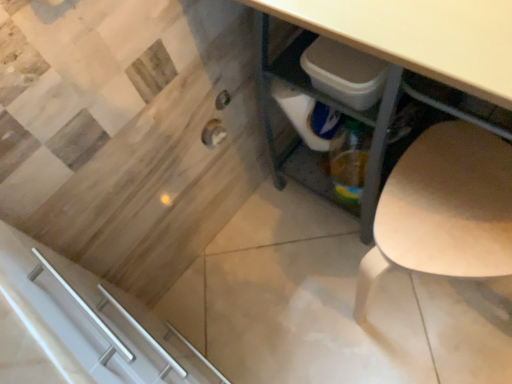
Question: Does point (421, 152) appear closer or farther from the camera than point (397, 23)?

Choices:
 (A) farther
 (B) closer

Answer: (A)

Question: Considering the positions of light wood chair at lower right and matte white desk at center in the image, is light wood chair at lower right bigger or smaller than matte white desk at center?

Choices:
 (A) small
 (B) big

Answer: (A)

Question: In the image, is light wood chair at lower right positioned in front of or behind matte white desk at center?

Choices:
 (A) front
 (B) behind

Answer: (B)

Question: Considering the positions of matte white desk at center and light wood chair at lower right in the image, is matte white desk at center wider or thinner than light wood chair at lower right?

Choices:
 (A) wide
 (B) thin

Answer: (A)

Question: Considering their positions, is matte white desk at center located in front of or behind light wood chair at lower right?

Choices:
 (A) behind
 (B) front

Answer: (B)

Question: In terms of size, does matte white desk at center appear bigger or smaller than light wood chair at lower right?

Choices:
 (A) small
 (B) big

Answer: (B)

Question: In terms of height, does matte white desk at center look taller or shorter compared to light wood chair at lower right?

Choices:
 (A) short
 (B) tall

Answer: (B)